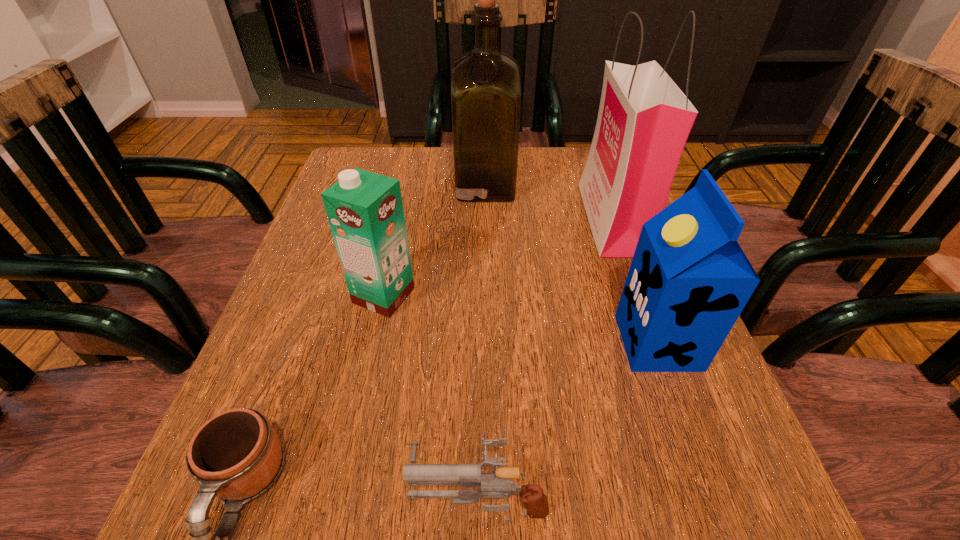
Locate an element on the screen. object located in the far right corner section of the desktop is located at coordinates point(644,119).

The image size is (960, 540). I want to click on vacant space at the far edge of the desktop, so click(445, 196).

This screenshot has height=540, width=960. What are the coordinates of `vacant space at the left edge of the desktop` in the screenshot? It's located at (292, 303).

What are the coordinates of `vacant region at the right edge of the desktop` in the screenshot? It's located at (598, 301).

In the image, there is a desktop. At what (x,y) coordinates should I click in order to perform the action: click on vacant space at the far right corner. Please return your answer as a coordinate pair (x, y). This screenshot has height=540, width=960. Looking at the image, I should click on (576, 168).

You are a GUI agent. You are given a task and a screenshot of the screen. Output one action in this format:
    pyautogui.click(x=<x>, y=<y>)
    Task: Click on the unoccupied position between the second object from left to right and the right carton
    The width and height of the screenshot is (960, 540).
    Given the screenshot: What is the action you would take?
    pyautogui.click(x=520, y=319)

Locate an element on the screen. free space between the left carton and the liquor is located at coordinates pos(434,240).

The width and height of the screenshot is (960, 540). I want to click on vacant area that lies between the liquor and the third shortest object, so click(x=434, y=240).

Locate an element on the screen. The height and width of the screenshot is (540, 960). empty location between the liquor and the left carton is located at coordinates (434, 240).

The width and height of the screenshot is (960, 540). In order to click on the fifth closest object to the shortest object in this screenshot , I will do [x=644, y=119].